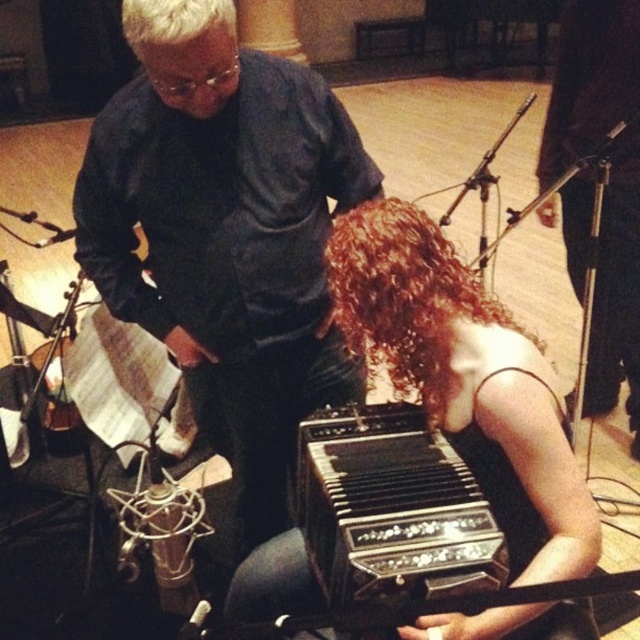
You are a photographer setting up for a shoot in this music studio. You need to place a light to the left of the shiny black accordion at center and to the right of the curly brown hair at lower center. Is this possible based on their current positions?

The shiny black accordion at center is positioned on the right side of curly brown hair at lower center. Therefore, placing a light to the left of the shiny black accordion at center and to the right of the curly brown hair at lower center is possible since the accordion is already to the right of the curly brown hair at lower center.

You are a photographer in this recording studio. You want to take a photo of the curly brown hair at lower center without the shiny black accordion at center blocking the view. Is this possible?

The shiny black accordion at center is in front of curly brown hair at lower center, so you cannot take a photo of the curly brown hair at lower center without the shiny black accordion at center blocking the view.

What is the exact coordinate of the black polished wood accordion at lower center?

The black polished wood accordion at lower center is located at point (392, 509).